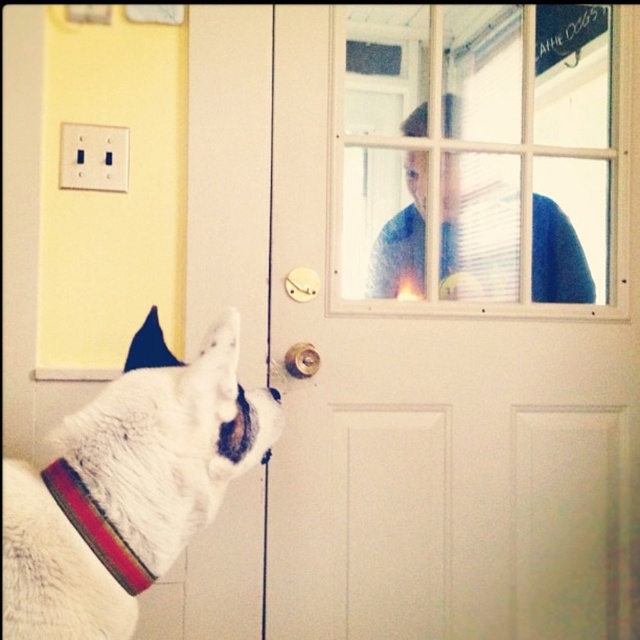
Question: Based on their relative distances, which object is nearer to the white fur collar at lower left?

Choices:
 (A) white matte screen door at center
 (B) multicolored woven band at lower left
 (C) clear glass window at upper center
 (D) gold metallic door handle at center

Answer: (B)

Question: Does white fur collar at lower left lie in front of gold metallic door handle at center?

Choices:
 (A) yes
 (B) no

Answer: (A)

Question: Is clear glass window at upper center further to camera compared to multicolored woven band at lower left?

Choices:
 (A) no
 (B) yes

Answer: (B)

Question: Which point is closer to the camera taking this photo?

Choices:
 (A) (104, 524)
 (B) (561, 148)
 (C) (316, 355)
 (D) (516, 154)

Answer: (A)

Question: Among these objects, which one is nearest to the camera?

Choices:
 (A) white fur collar at lower left
 (B) white matte screen door at center
 (C) gold metallic door handle at center
 (D) multicolored woven band at lower left

Answer: (A)

Question: In this image, where is white matte screen door at center located relative to clear glass window at upper center?

Choices:
 (A) left
 (B) right

Answer: (A)